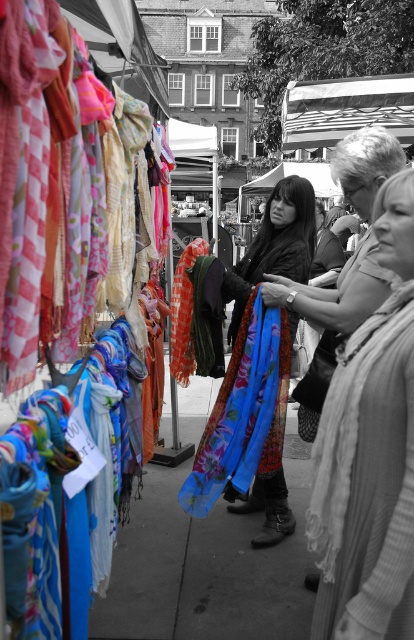
This screenshot has width=414, height=640. Identify the location of knitted sweater at center. (366, 480).

Is knitted sweater at center to the right of floral silk scarf at center from the viewer's perspective?

Yes, knitted sweater at center is to the right of floral silk scarf at center.

Which is in front, point (331, 413) or point (303, 218)?

Point (331, 413) is more forward.

Locate an element on the screen. Image resolution: width=414 pixels, height=640 pixels. knitted sweater at center is located at coordinates (366, 480).

Is textured gray scarf at right wider than blue floral scarf at center?

No, textured gray scarf at right is not wider than blue floral scarf at center.

Is textured gray scarf at right in front of blue floral scarf at center?

Yes, textured gray scarf at right is closer to the viewer.

Is point (310, 403) closer to viewer compared to point (226, 339)?

Yes, point (310, 403) is in front of point (226, 339).

Where is `textured gray scarf at right`? Image resolution: width=414 pixels, height=640 pixels. textured gray scarf at right is located at coordinates (317, 380).

Can you confirm if blue fabric at center is wider than textured gray scarf at right?

Correct, the width of blue fabric at center exceeds that of textured gray scarf at right.

Which of these two, blue fabric at center or textured gray scarf at right, stands shorter?

blue fabric at center is shorter.

Where is `blue fabric at center`? blue fabric at center is located at coordinates (206, 566).